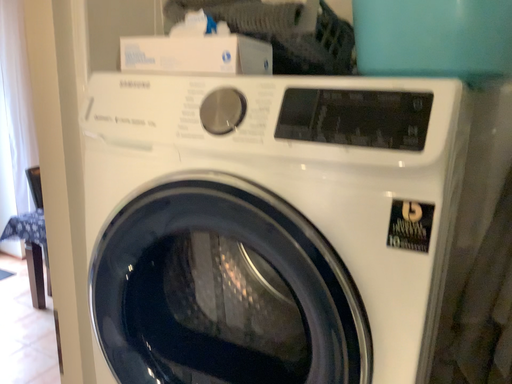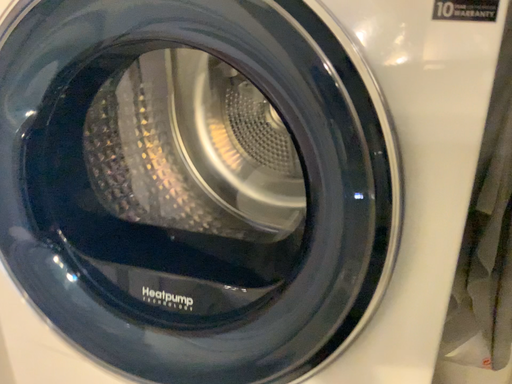
Question: How did the camera likely rotate when shooting the video?

Choices:
 (A) rotated left
 (B) rotated right

Answer: (B)